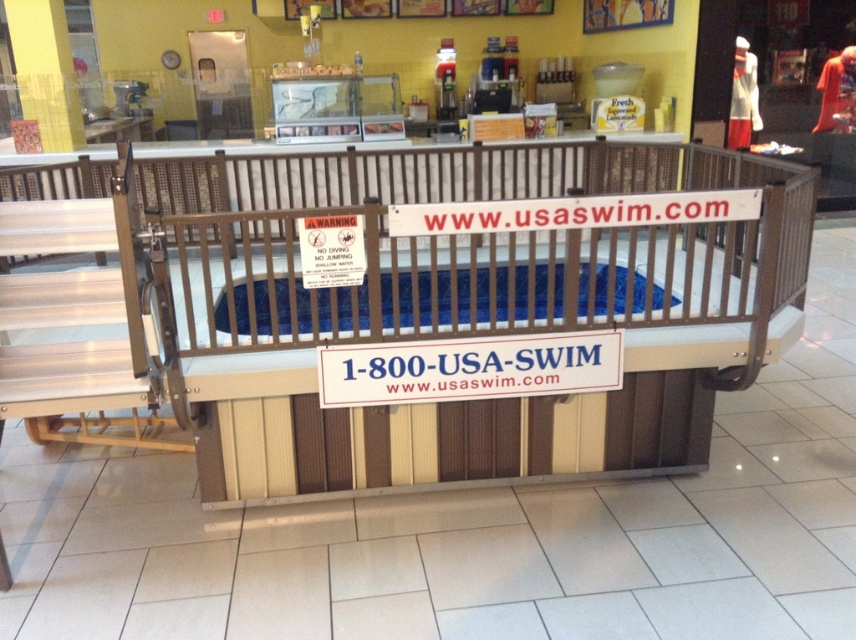
Who is positioned more to the left, white plastic sign at center or blue plastic infant bed at center?

blue plastic infant bed at center

Does white plastic sign at center have a smaller size compared to blue plastic infant bed at center?

Yes.

Is point (435, 349) less distant than point (275, 292)?

Yes, point (435, 349) is closer to viewer.

Locate an element on the screen. This screenshot has height=640, width=856. white plastic sign at center is located at coordinates (468, 369).

Locate an element on the screen. blue fabric infant bed at center is located at coordinates (467, 272).

Is point (266, 312) closer to viewer compared to point (355, 397)?

No.

Where is `blue fabric infant bed at center`? blue fabric infant bed at center is located at coordinates (467, 272).

Does blue fabric infant bed at center have a larger size compared to blue plastic infant bed at center?

Correct, blue fabric infant bed at center is larger in size than blue plastic infant bed at center.

Is point (280, 292) farther from viewer compared to point (623, 268)?

No, it is not.

This screenshot has height=640, width=856. What are the coordinates of `blue fabric infant bed at center` in the screenshot? It's located at (467, 272).